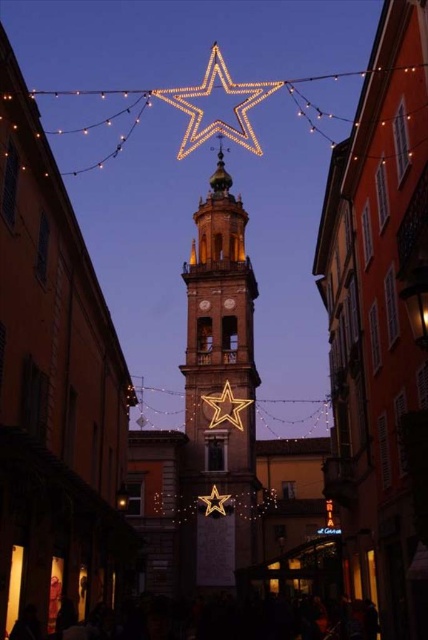
Question: Which object appears closest to the camera in this image?

Choices:
 (A) illuminated gold star at center
 (B) gold metallic bell tower at center

Answer: (B)

Question: Considering the relative positions of gold metallic bell tower at center and gold metallic star at center in the image provided, where is gold metallic bell tower at center located with respect to gold metallic star at center?

Choices:
 (A) above
 (B) below

Answer: (A)

Question: Which object appears closest to the camera in this image?

Choices:
 (A) gold metallic star at center
 (B) gold metallic bell tower at center

Answer: (B)

Question: Which point is closer to the camera?

Choices:
 (A) (210, 424)
 (B) (231, 392)
 (C) (225, 508)

Answer: (C)

Question: Is gold metallic bell tower at center above gold metallic star at center?

Choices:
 (A) no
 (B) yes

Answer: (B)

Question: Can you confirm if gold metallic bell tower at center is smaller than illuminated gold star at center?

Choices:
 (A) no
 (B) yes

Answer: (A)